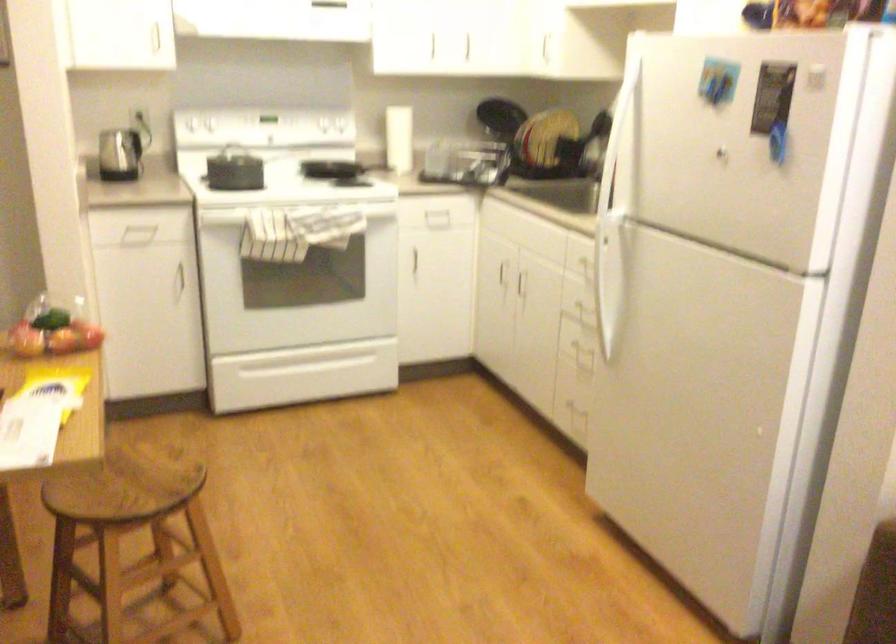
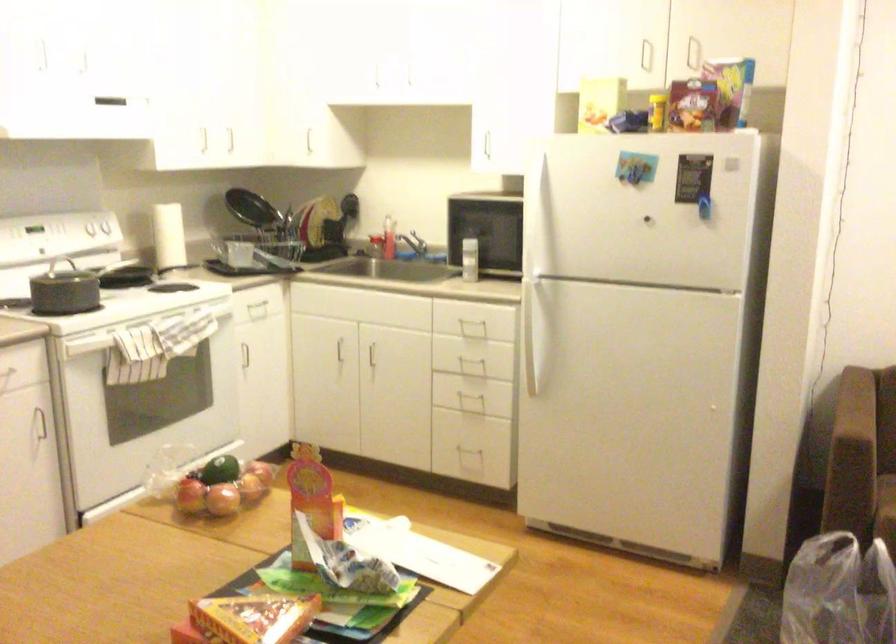
Locate, in the second image, the point that corresponds to pixel 609 306 in the first image.

(536, 350)